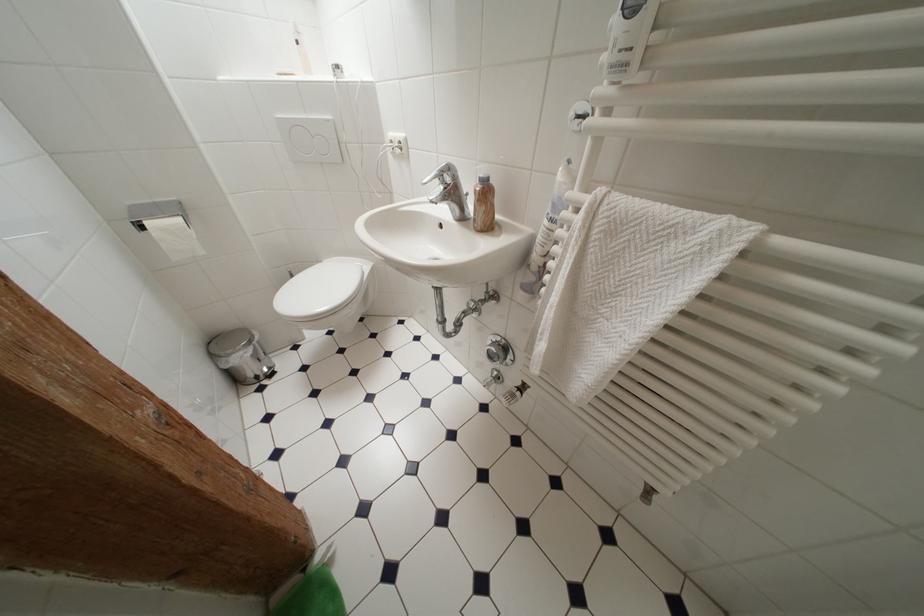
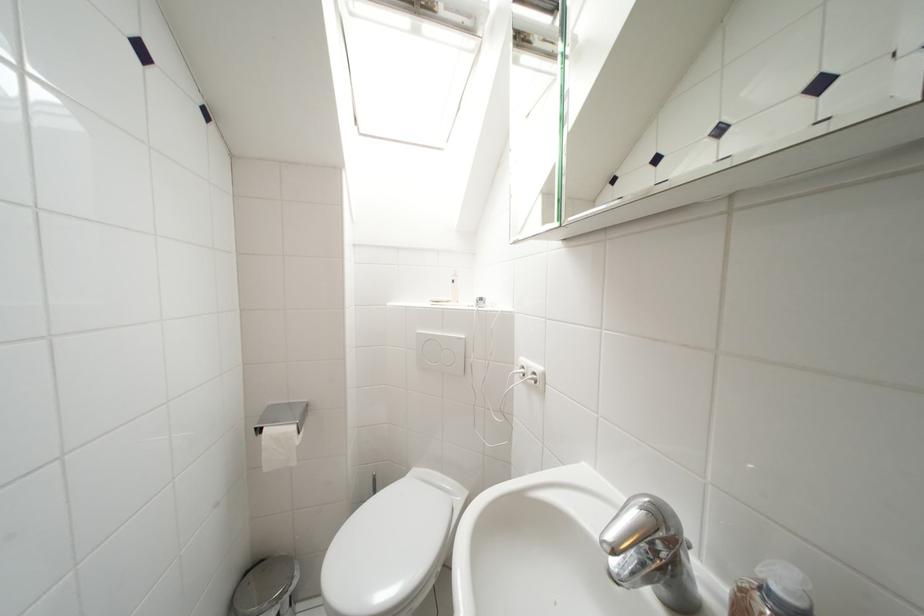
The first image is from the beginning of the video and the second image is from the end. How did the camera likely rotate when shooting the video?

The camera rotated toward left-up.